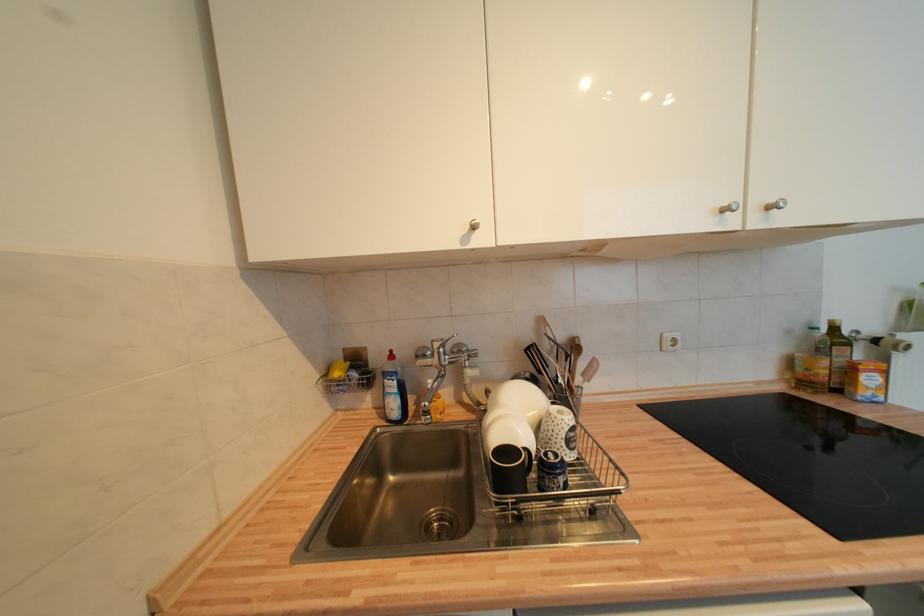
The location [337,369] corresponds to which object?

It refers to a yellow sponge.